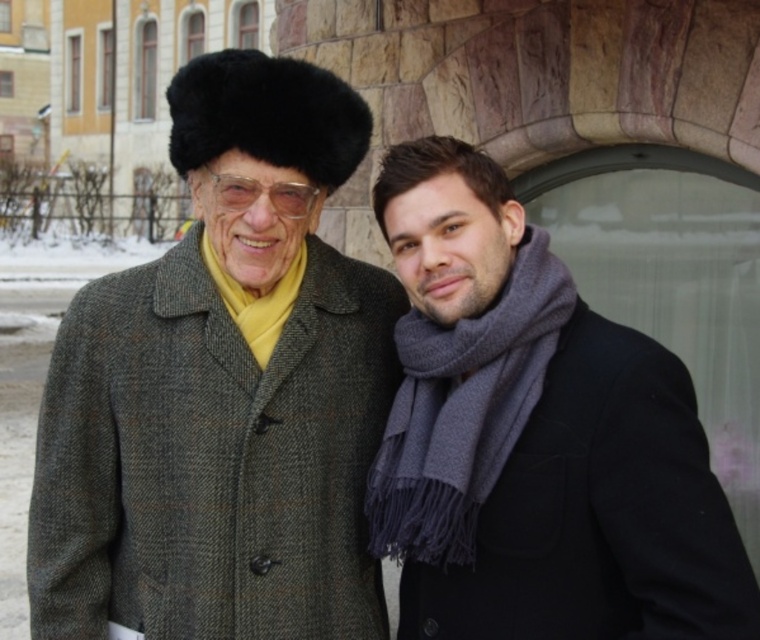
Who is lower down, gray woolen scarf at right or black fur hat at upper left?

gray woolen scarf at right is lower down.

Does gray woolen scarf at right have a greater width compared to black fur hat at upper left?

No.

Locate an element on the screen. gray woolen scarf at right is located at coordinates (464, 410).

In the scene shown: Does gray woolen scarf at right have a greater width compared to transparent plastic glasses at center?

Yes, gray woolen scarf at right is wider than transparent plastic glasses at center.

What are the coordinates of `gray woolen scarf at right` in the screenshot? It's located at (464, 410).

Is black fur hat at upper left thinner than transparent plastic glasses at center?

No.

Does black fur hat at upper left appear on the left side of transparent plastic glasses at center?

A: Correct, you'll find black fur hat at upper left to the left of transparent plastic glasses at center.

Who is more forward, (323, 148) or (280, 212)?

Positioned in front is point (280, 212).

The image size is (760, 640). Find the location of `black fur hat at upper left`. black fur hat at upper left is located at coordinates (266, 115).